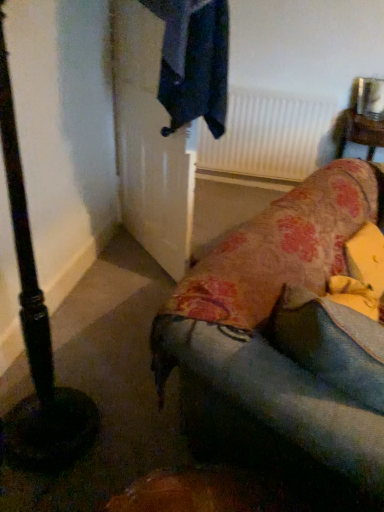
The image size is (384, 512). Identify the location of wooden table at upper right. (360, 133).

Locate an element on the screen. This screenshot has height=512, width=384. white matte radiator at upper center is located at coordinates 269,136.

Is wooden table at upper right facing away from floral fabric studio couch at lower right?

wooden table at upper right is not turned away from floral fabric studio couch at lower right.

From the image's perspective, relative to floral fabric studio couch at lower right, is wooden table at upper right above or below?

Based on their image positions, wooden table at upper right is located above floral fabric studio couch at lower right.

Is wooden table at upper right next to floral fabric studio couch at lower right?

No, wooden table at upper right is not touching floral fabric studio couch at lower right.

The height and width of the screenshot is (512, 384). I want to click on studio couch below the wooden table at upper right (from the image's perspective), so click(269, 338).

Who is shorter, floral fabric studio couch at lower right or wooden table at upper right?

With less height is wooden table at upper right.

Is floral fabric studio couch at lower right beside wooden table at upper right?

floral fabric studio couch at lower right and wooden table at upper right are clearly separated.

From a real-world perspective, is floral fabric studio couch at lower right positioned over wooden table at upper right based on gravity?

Yes, from a real-world perspective, floral fabric studio couch at lower right is above wooden table at upper right.

Would you say white matte radiator at upper center is to the left or to the right of floral fabric studio couch at lower right in the picture?

Based on their positions, white matte radiator at upper center is located to the right of floral fabric studio couch at lower right.

Could you tell me if white matte radiator at upper center is facing floral fabric studio couch at lower right?

Yes, white matte radiator at upper center is turned towards floral fabric studio couch at lower right.

Which object is closer to the camera taking this photo, white matte radiator at upper center or floral fabric studio couch at lower right?

floral fabric studio couch at lower right is in front.

Does white matte radiator at upper center have a smaller size compared to floral fabric studio couch at lower right?

Correct, white matte radiator at upper center occupies less space than floral fabric studio couch at lower right.

From a real-world perspective, is denim cushion at lower right physically located above or below floral fabric studio couch at lower right?

In terms of real-world spatial position, denim cushion at lower right is below floral fabric studio couch at lower right.

Measure the distance from denim cushion at lower right to floral fabric studio couch at lower right.

denim cushion at lower right is 28.00 centimeters away from floral fabric studio couch at lower right.

Considering the relative sizes of denim cushion at lower right and floral fabric studio couch at lower right in the image provided, is denim cushion at lower right shorter than floral fabric studio couch at lower right?

Correct, denim cushion at lower right is not as tall as floral fabric studio couch at lower right.

From the picture: Considering the sizes of denim cushion at lower right and floral fabric studio couch at lower right in the image, is denim cushion at lower right wider or thinner than floral fabric studio couch at lower right?

In the image, denim cushion at lower right appears to be more narrow than floral fabric studio couch at lower right.

Is white matte radiator at upper center shorter than black matte pole at left?

Indeed, white matte radiator at upper center has a lesser height compared to black matte pole at left.

From a real-world perspective, relative to black matte pole at left, is white matte radiator at upper center vertically above or below?

Clearly, from a real-world perspective, white matte radiator at upper center is below black matte pole at left.

Is the depth of white matte radiator at upper center less than that of black matte pole at left?

No, white matte radiator at upper center is further to the viewer.

Which of these two, white matte radiator at upper center or black matte pole at left, is thinner?

white matte radiator at upper center.

Can you confirm if denim cushion at lower right is positioned to the right of wooden table at upper right?

Incorrect, denim cushion at lower right is not on the right side of wooden table at upper right.

Does point (365, 401) come farther from viewer compared to point (383, 143)?

No.

Is denim cushion at lower right spatially inside wooden table at upper right, or outside of it?

denim cushion at lower right exists outside the volume of wooden table at upper right.

Measure the distance from denim cushion at lower right to wooden table at upper right.

They are 1.91 meters apart.

Can you confirm if black matte pole at left is positioned to the right of white matte radiator at upper center?

No.

From the image's perspective, is black matte pole at left located above white matte radiator at upper center?

Incorrect, from the image's perspective, black matte pole at left is lower than white matte radiator at upper center.

Is black matte pole at left oriented away from white matte radiator at upper center?

No, black matte pole at left's orientation is not away from white matte radiator at upper center.

Is white matte radiator at upper center located within black matte pole at left?

No.

This screenshot has height=512, width=384. I want to click on studio couch on the left of wooden table at upper right, so click(x=269, y=338).

This screenshot has width=384, height=512. Find the location of `furniture lying behind the floral fabric studio couch at lower right`. furniture lying behind the floral fabric studio couch at lower right is located at coordinates (360, 133).

Estimate the real-world distances between objects in this image. Which object is closer to wooden table at upper right, denim cushion at lower right or black matte pole at left?

denim cushion at lower right.

When comparing their distances from denim cushion at lower right, does black matte pole at left or floral fabric studio couch at lower right seem further?

Based on the image, black matte pole at left appears to be further to denim cushion at lower right.

Which object lies nearer to the anchor point floral fabric studio couch at lower right, white matte radiator at upper center or wooden table at upper right?

wooden table at upper right.

From the image, which object appears to be nearer to denim cushion at lower right, white matte radiator at upper center or wooden table at upper right?

Among the two, wooden table at upper right is located nearer to denim cushion at lower right.

Based on their spatial positions, is white matte radiator at upper center or floral fabric studio couch at lower right closer to denim cushion at lower right?

Based on the image, floral fabric studio couch at lower right appears to be nearer to denim cushion at lower right.

Considering their positions, is denim cushion at lower right positioned closer to wooden table at upper right than white matte radiator at upper center?

Among the two, white matte radiator at upper center is located nearer to wooden table at upper right.

Looking at the image, which one is located further to white matte radiator at upper center, floral fabric studio couch at lower right or black matte pole at left?

Among the two, black matte pole at left is located further to white matte radiator at upper center.

Based on their spatial positions, is floral fabric studio couch at lower right or wooden table at upper right further from denim cushion at lower right?

Based on the image, wooden table at upper right appears to be further to denim cushion at lower right.

Locate an element on the screen. studio couch positioned between black matte pole at left and wooden table at upper right from near to far is located at coordinates (269, 338).

The height and width of the screenshot is (512, 384). What are the coordinates of `studio couch between black matte pole at left and denim cushion at lower right from left to right` in the screenshot? It's located at (269, 338).

The height and width of the screenshot is (512, 384). In order to click on pillow positioned between floral fabric studio couch at lower right and wooden table at upper right from near to far in this screenshot , I will do `click(332, 344)`.

Image resolution: width=384 pixels, height=512 pixels. What are the coordinates of `pillow between black matte pole at left and wooden table at upper right along the z-axis` in the screenshot? It's located at (332, 344).